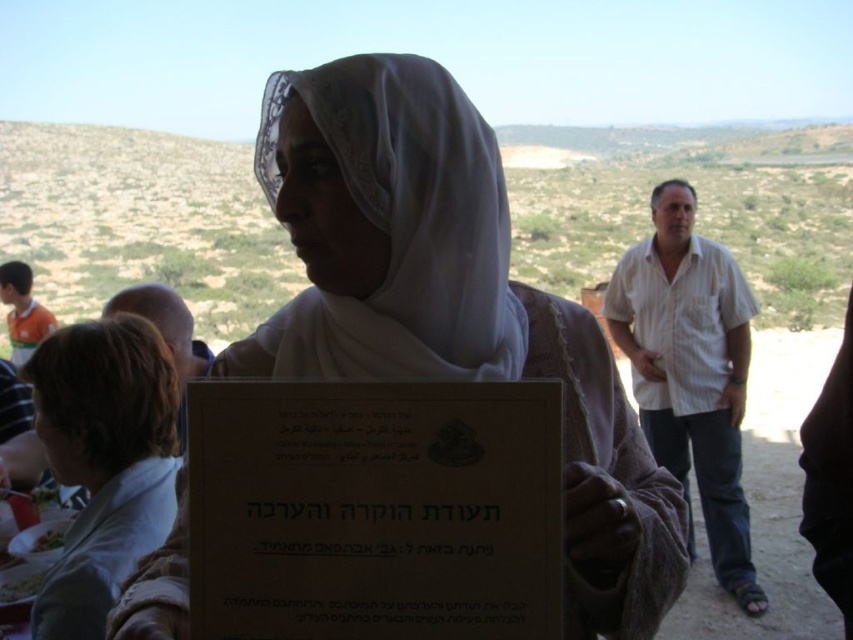
Question: Which of the following is the closest to the observer?

Choices:
 (A) white lace headscarf at center
 (B) green leafy vegetable at lower left
 (C) white sheer veil at center

Answer: (A)

Question: Is brown cardboard plaque at center wider than green leafy vegetable at lower left?

Choices:
 (A) yes
 (B) no

Answer: (A)

Question: Is brown cardboard plaque at center to the right of white sheer veil at center from the viewer's perspective?

Choices:
 (A) yes
 (B) no

Answer: (A)

Question: Does white lace headscarf at center have a lesser width compared to white sheer veil at center?

Choices:
 (A) no
 (B) yes

Answer: (A)

Question: Considering the real-world distances, which object is closest to the white lace headscarf at center?

Choices:
 (A) brown cardboard plaque at center
 (B) white glossy plate at lower left
 (C) light brown hair at lower left
 (D) green leafy vegetable at lower left

Answer: (A)

Question: Which object is closer to the camera taking this photo?

Choices:
 (A) white lace headscarf at center
 (B) green leafy vegetable at lower left
 (C) white glossy plate at lower left
 (D) white sheer veil at center

Answer: (A)